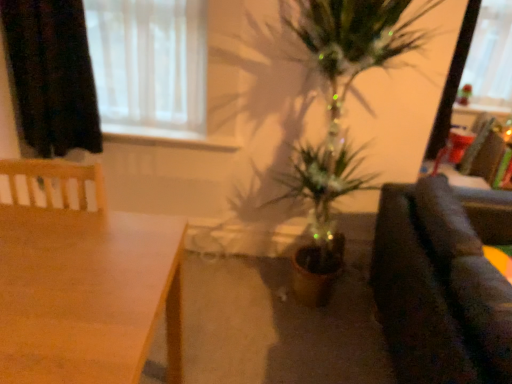
Question: Could you tell me if white sheer curtain at upper left is turned towards dark fabric couch at right?

Choices:
 (A) no
 (B) yes

Answer: (A)

Question: Considering the relative sizes of white sheer curtain at upper left and dark fabric couch at right in the image provided, is white sheer curtain at upper left smaller than dark fabric couch at right?

Choices:
 (A) no
 (B) yes

Answer: (B)

Question: Can you confirm if white sheer curtain at upper left is shorter than dark fabric couch at right?

Choices:
 (A) yes
 (B) no

Answer: (A)

Question: From a real-world perspective, does white sheer curtain at upper left stand above dark fabric couch at right?

Choices:
 (A) yes
 (B) no

Answer: (A)

Question: Is white sheer curtain at upper left positioned before dark fabric couch at right?

Choices:
 (A) no
 (B) yes

Answer: (A)

Question: In the image, is black fabric curtain at upper left positioned in front of or behind wooden table at lower left?

Choices:
 (A) behind
 (B) front

Answer: (A)

Question: Is black fabric curtain at upper left inside the boundaries of wooden table at lower left, or outside?

Choices:
 (A) outside
 (B) inside

Answer: (A)

Question: Does point (20, 16) appear closer or farther from the camera than point (55, 342)?

Choices:
 (A) farther
 (B) closer

Answer: (A)

Question: In terms of width, does black fabric curtain at upper left look wider or thinner when compared to wooden table at lower left?

Choices:
 (A) thin
 (B) wide

Answer: (A)

Question: From a real-world perspective, is white sheer curtain at upper left physically located above or below wooden table at lower left?

Choices:
 (A) below
 (B) above

Answer: (B)

Question: From the image's perspective, is white sheer curtain at upper left positioned above or below wooden table at lower left?

Choices:
 (A) above
 (B) below

Answer: (A)

Question: Considering the positions of white sheer curtain at upper left and wooden table at lower left in the image, is white sheer curtain at upper left bigger or smaller than wooden table at lower left?

Choices:
 (A) small
 (B) big

Answer: (A)

Question: Is white sheer curtain at upper left to the left or to the right of wooden table at lower left in the image?

Choices:
 (A) left
 (B) right

Answer: (B)

Question: In the image, is white sheer curtain at upper left positioned in front of or behind black fabric curtain at upper left?

Choices:
 (A) behind
 (B) front

Answer: (A)

Question: Considering the positions of white sheer curtain at upper left and black fabric curtain at upper left in the image, is white sheer curtain at upper left taller or shorter than black fabric curtain at upper left?

Choices:
 (A) tall
 (B) short

Answer: (B)